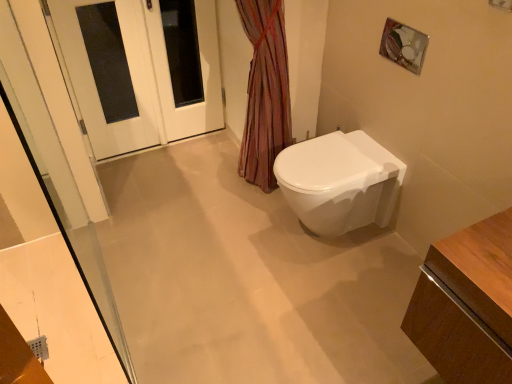
At what (x,y) coordinates should I click in order to perform the action: click on free space in front of white glossy door at upper left. Please return your answer as a coordinate pair (x, y). The height and width of the screenshot is (384, 512). Looking at the image, I should click on (158, 182).